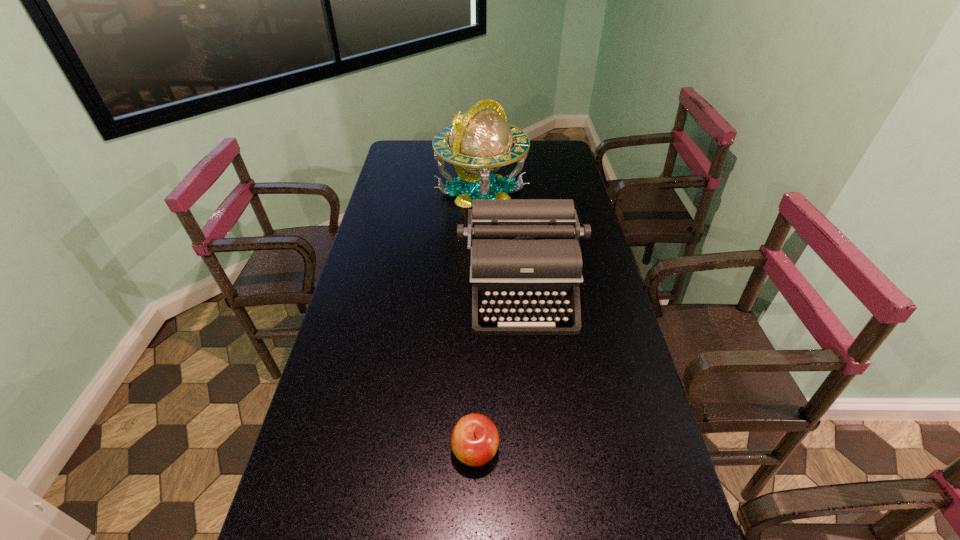
Where is `vacant position at the left edge of the desktop`? This screenshot has height=540, width=960. vacant position at the left edge of the desktop is located at coordinates (345, 504).

Find the location of a particular element. free space at the right edge of the desktop is located at coordinates (602, 318).

At what (x,y) coordinates should I click in order to perform the action: click on free spot at the far left corner of the desktop. Please return your answer as a coordinate pair (x, y). The image size is (960, 540). Looking at the image, I should click on (414, 145).

Where is `free space at the far right corner of the desktop`? free space at the far right corner of the desktop is located at coordinates (571, 163).

Image resolution: width=960 pixels, height=540 pixels. What are the coordinates of `free space between the second nearest object and the shortest object` in the screenshot? It's located at (498, 370).

Locate an element on the screen. The width and height of the screenshot is (960, 540). unoccupied area between the second farthest object and the nearest object is located at coordinates (498, 370).

Choose which object is the second nearest neighbor to the shortest object. Please provide its 2D coordinates. Your answer should be formatted as a tuple, i.e. [(x, y)], where the tuple contains the x and y coordinates of a point satisfying the conditions above.

[(480, 140)]

At what (x,y) coordinates should I click in order to perform the action: click on object identified as the closest to the tallest object. Please return your answer as a coordinate pair (x, y). The height and width of the screenshot is (540, 960). Looking at the image, I should click on (523, 252).

Where is `free location that satisfies the following two spatial constraints: 1. on the back side of the shortest object; 2. on the left side of the tallest object`? The width and height of the screenshot is (960, 540). free location that satisfies the following two spatial constraints: 1. on the back side of the shortest object; 2. on the left side of the tallest object is located at coordinates (477, 191).